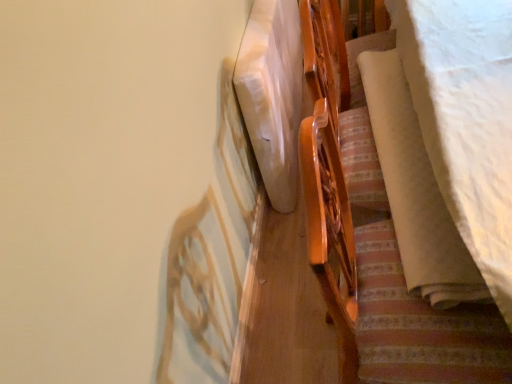
The image size is (512, 384). I want to click on blank space situated above white soft fabric at right (from a real-world perspective), so click(x=402, y=142).